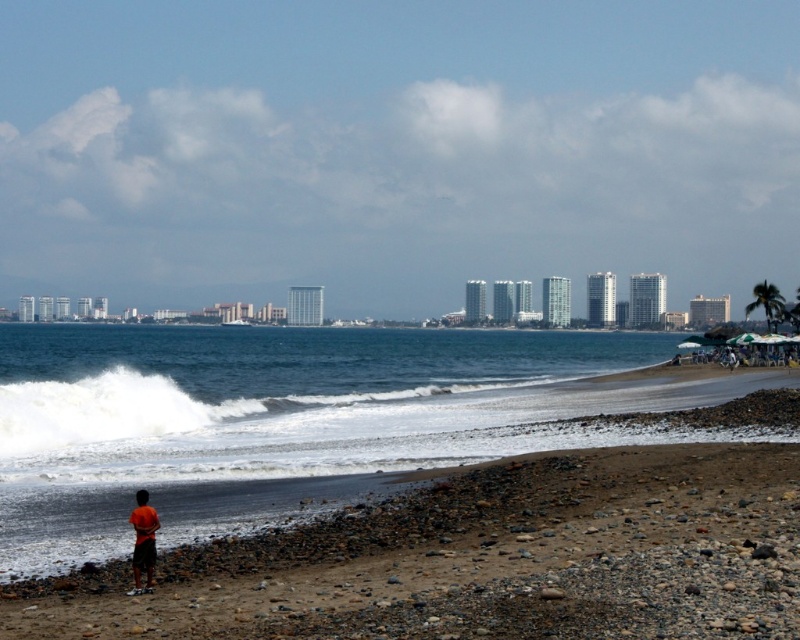
Who is higher up, blue water at lower left or orange fabric shorts at lower left?

blue water at lower left is higher up.

Measure the distance between blue water at lower left and orange fabric shorts at lower left.

blue water at lower left is 150.83 meters from orange fabric shorts at lower left.

Does point (310, 403) lie behind point (152, 516)?

Yes, point (310, 403) is farther from viewer.

What are the coordinates of `blue water at lower left` in the screenshot? It's located at (277, 419).